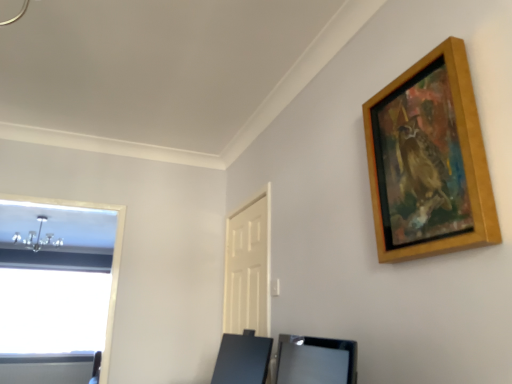
What do you see at coordinates (242, 359) in the screenshot?
I see `black glossy vanity at lower center, which is the 2th vanity from front to back` at bounding box center [242, 359].

Where is `satin black vanity at lower center, which is the first vanity in front-to-back order`? satin black vanity at lower center, which is the first vanity in front-to-back order is located at coordinates (316, 360).

Identify the location of vanity behind the satin black vanity at lower center, which is the first vanity in front-to-back order. (242, 359).

Which object is positioned more to the left, satin black vanity at lower center, which is the first vanity in front-to-back order, or black glossy vanity at lower center, which is the 2th vanity from front to back?

Positioned to the left is black glossy vanity at lower center, which is the 2th vanity from front to back.

Is satin black vanity at lower center, arranged as the second vanity when viewed from the back, far away from black glossy vanity at lower center, the 1th vanity viewed from the back?

They are positioned close to each other.

Is satin black vanity at lower center, which is the first vanity in front-to-back order, in front of or behind black glossy vanity at lower center, the 1th vanity viewed from the back, in the image?

Clearly, satin black vanity at lower center, which is the first vanity in front-to-back order, is in front of black glossy vanity at lower center, the 1th vanity viewed from the back.

Can you confirm if white matte door at center is smaller than black glossy vanity at lower center, which is the 2th vanity from front to back?

Yes.

Is white matte door at center far away from black glossy vanity at lower center, which is the 2th vanity from front to back?

No, there isn't a large distance between white matte door at center and black glossy vanity at lower center, which is the 2th vanity from front to back.

Measure the distance between white matte door at center and black glossy vanity at lower center, the 1th vanity viewed from the back.

white matte door at center and black glossy vanity at lower center, the 1th vanity viewed from the back, are 17.77 inches apart from each other.

Is white matte door at center positioned behind black glossy vanity at lower center, which is the 2th vanity from front to back?

Yes, white matte door at center is behind black glossy vanity at lower center, which is the 2th vanity from front to back.

Is black glossy vanity at lower center, which is the 2th vanity from front to back, to the left of satin black vanity at lower center, which is the first vanity in front-to-back order, from the viewer's perspective?

Yes.

From a real-world perspective, is black glossy vanity at lower center, the 1th vanity viewed from the back, below satin black vanity at lower center, which is the first vanity in front-to-back order?

Yes, from a real-world perspective, black glossy vanity at lower center, the 1th vanity viewed from the back, is below satin black vanity at lower center, which is the first vanity in front-to-back order.

Considering the relative sizes of black glossy vanity at lower center, the 1th vanity viewed from the back, and satin black vanity at lower center, arranged as the second vanity when viewed from the back, in the image provided, is black glossy vanity at lower center, the 1th vanity viewed from the back, smaller than satin black vanity at lower center, arranged as the second vanity when viewed from the back,?

Actually, black glossy vanity at lower center, the 1th vanity viewed from the back, might be larger than satin black vanity at lower center, arranged as the second vanity when viewed from the back.

Is black glossy vanity at lower center, which is the 2th vanity from front to back, surrounding satin black vanity at lower center, arranged as the second vanity when viewed from the back?

Actually, satin black vanity at lower center, arranged as the second vanity when viewed from the back, is outside black glossy vanity at lower center, which is the 2th vanity from front to back.

Based on the photo, is black glossy vanity at lower center, which is the 2th vanity from front to back, facing away from wooden picture frame at upper right?

That's not correct — black glossy vanity at lower center, which is the 2th vanity from front to back, is not looking away from wooden picture frame at upper right.

From a real-world perspective, is black glossy vanity at lower center, which is the 2th vanity from front to back, positioned above or below wooden picture frame at upper right?

In terms of real-world spatial position, black glossy vanity at lower center, which is the 2th vanity from front to back, is below wooden picture frame at upper right.

Which is in front, point (254, 346) or point (397, 241)?

The point (397, 241) is closer.

From the image's perspective, is black glossy vanity at lower center, the 1th vanity viewed from the back, positioned above or below wooden picture frame at upper right?

Based on their image positions, black glossy vanity at lower center, the 1th vanity viewed from the back, is located beneath wooden picture frame at upper right.

Based on the photo, would you consider wooden picture frame at upper right to be distant from satin black vanity at lower center, which is the first vanity in front-to-back order?

That's not correct — wooden picture frame at upper right is a little close to satin black vanity at lower center, which is the first vanity in front-to-back order.

In terms of size, does wooden picture frame at upper right appear bigger or smaller than satin black vanity at lower center, which is the first vanity in front-to-back order?

Clearly, wooden picture frame at upper right is larger in size than satin black vanity at lower center, which is the first vanity in front-to-back order.

Considering the positions of objects wooden picture frame at upper right and satin black vanity at lower center, arranged as the second vanity when viewed from the back, in the image provided, who is more to the right, wooden picture frame at upper right or satin black vanity at lower center, arranged as the second vanity when viewed from the back,?

wooden picture frame at upper right.

The width and height of the screenshot is (512, 384). I want to click on picture frame to the right of satin black vanity at lower center, which is the first vanity in front-to-back order, so click(429, 161).

Does satin black vanity at lower center, which is the first vanity in front-to-back order, appear on the right side of wooden picture frame at upper right?

No, satin black vanity at lower center, which is the first vanity in front-to-back order, is not to the right of wooden picture frame at upper right.

Is satin black vanity at lower center, which is the first vanity in front-to-back order, far away from wooden picture frame at upper right?

That's not correct — satin black vanity at lower center, which is the first vanity in front-to-back order, is a little close to wooden picture frame at upper right.

Is satin black vanity at lower center, which is the first vanity in front-to-back order, completely or partially outside of wooden picture frame at upper right?

Absolutely, satin black vanity at lower center, which is the first vanity in front-to-back order, is external to wooden picture frame at upper right.

Consider the image. How many degrees apart are the facing directions of satin black vanity at lower center, which is the first vanity in front-to-back order, and wooden picture frame at upper right?

The facing directions of satin black vanity at lower center, which is the first vanity in front-to-back order, and wooden picture frame at upper right are 5.28 degrees apart.

Are white matte door at center and satin black vanity at lower center, arranged as the second vanity when viewed from the back, located far from each other?

white matte door at center is near satin black vanity at lower center, arranged as the second vanity when viewed from the back, not far away.

Considering the sizes of objects white matte door at center and satin black vanity at lower center, which is the first vanity in front-to-back order, in the image provided, who is smaller, white matte door at center or satin black vanity at lower center, which is the first vanity in front-to-back order,?

With smaller size is satin black vanity at lower center, which is the first vanity in front-to-back order.

In order to click on door above the satin black vanity at lower center, which is the first vanity in front-to-back order (from the image's perspective) in this screenshot , I will do `click(248, 269)`.

Between white matte door at center and satin black vanity at lower center, arranged as the second vanity when viewed from the back, which one has less height?

Standing shorter between the two is satin black vanity at lower center, arranged as the second vanity when viewed from the back.

Where is `vanity below the satin black vanity at lower center, which is the first vanity in front-to-back order (from a real-world perspective)`? vanity below the satin black vanity at lower center, which is the first vanity in front-to-back order (from a real-world perspective) is located at coordinates (242, 359).

The height and width of the screenshot is (384, 512). Find the location of `door lying behind the black glossy vanity at lower center, the 1th vanity viewed from the back`. door lying behind the black glossy vanity at lower center, the 1th vanity viewed from the back is located at coordinates (248, 269).

Considering their positions, is wooden picture frame at upper right positioned closer to black glossy vanity at lower center, which is the 2th vanity from front to back, than satin black vanity at lower center, which is the first vanity in front-to-back order?

satin black vanity at lower center, which is the first vanity in front-to-back order.

In the scene shown: Considering their positions, is satin black vanity at lower center, which is the first vanity in front-to-back order, positioned closer to white matte door at center than wooden picture frame at upper right?

satin black vanity at lower center, which is the first vanity in front-to-back order, lies closer to white matte door at center than the other object.

Based on their spatial positions, is black glossy vanity at lower center, the 1th vanity viewed from the back, or white matte door at center further from wooden picture frame at upper right?

white matte door at center lies further to wooden picture frame at upper right than the other object.

Consider the image. Which object lies further to the anchor point white matte door at center, black glossy vanity at lower center, which is the 2th vanity from front to back, or wooden picture frame at upper right?

wooden picture frame at upper right lies further to white matte door at center than the other object.

Based on their spatial positions, is wooden picture frame at upper right or black glossy vanity at lower center, which is the 2th vanity from front to back, further from satin black vanity at lower center, which is the first vanity in front-to-back order?

The object further to satin black vanity at lower center, which is the first vanity in front-to-back order, is wooden picture frame at upper right.

When comparing their distances from black glossy vanity at lower center, which is the 2th vanity from front to back, does wooden picture frame at upper right or white matte door at center seem closer?

white matte door at center is closer to black glossy vanity at lower center, which is the 2th vanity from front to back.

Consider the image. Estimate the real-world distances between objects in this image. Which object is further from wooden picture frame at upper right, satin black vanity at lower center, arranged as the second vanity when viewed from the back, or white matte door at center?

Among the two, white matte door at center is located further to wooden picture frame at upper right.

Based on their spatial positions, is black glossy vanity at lower center, which is the 2th vanity from front to back, or white matte door at center further from satin black vanity at lower center, arranged as the second vanity when viewed from the back?

white matte door at center is further to satin black vanity at lower center, arranged as the second vanity when viewed from the back.

Identify the location of vanity between satin black vanity at lower center, arranged as the second vanity when viewed from the back, and white matte door at center in the front-back direction. coord(242,359).

Where is `vanity between wooden picture frame at upper right and black glossy vanity at lower center, the 1th vanity viewed from the back, from top to bottom`? The image size is (512, 384). vanity between wooden picture frame at upper right and black glossy vanity at lower center, the 1th vanity viewed from the back, from top to bottom is located at coordinates (316, 360).